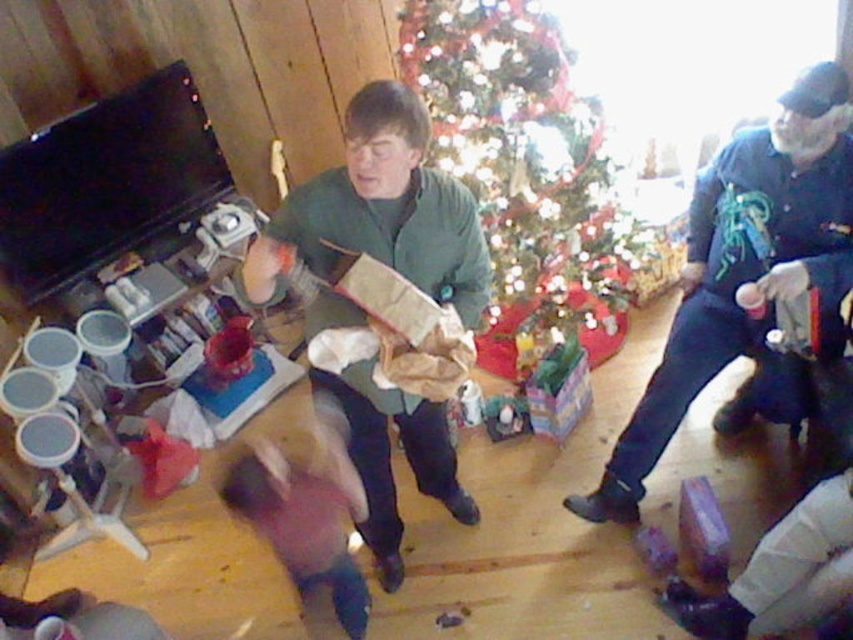
Which is below, blue denim jacket at right or green matte jacket at center?

green matte jacket at center

Does blue denim jacket at right have a larger size compared to green matte jacket at center?

No.

Measure the distance between point (721, 314) and camera.

The distance of point (721, 314) from camera is 2.56 meters.

The image size is (853, 640). I want to click on blue denim jacket at right, so click(744, 266).

Is shiny green christmas tree at center above blue denim jacket at right?

Yes, shiny green christmas tree at center is above blue denim jacket at right.

In the scene shown: Can you confirm if shiny green christmas tree at center is positioned below blue denim jacket at right?

No, shiny green christmas tree at center is not below blue denim jacket at right.

At what (x,y) coordinates should I click in order to perform the action: click on shiny green christmas tree at center. Please return your answer as a coordinate pair (x, y). Image resolution: width=853 pixels, height=640 pixels. Looking at the image, I should click on (527, 170).

Where is `shiny green christmas tree at center`? The width and height of the screenshot is (853, 640). shiny green christmas tree at center is located at coordinates (527, 170).

Is point (606, 259) more distant than point (242, 262)?

That is False.

Is shiny green christmas tree at center positioned behind green matte jacket at center?

Yes, it is behind green matte jacket at center.

The height and width of the screenshot is (640, 853). Find the location of `shiny green christmas tree at center`. shiny green christmas tree at center is located at coordinates (527, 170).

This screenshot has width=853, height=640. Identify the location of shiny green christmas tree at center. (527, 170).